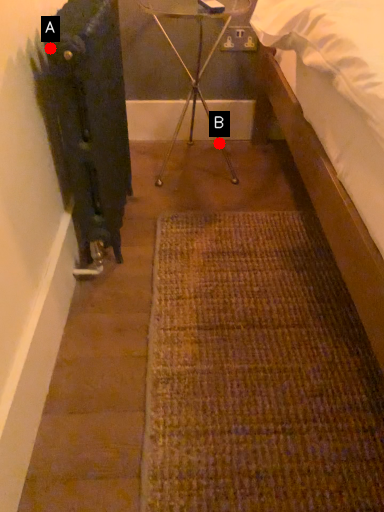
Question: Two points are circled on the image, labeled by A and B beside each circle. Which of the following is the closest to the observer?

Choices:
 (A) A is closer
 (B) B is closer

Answer: (A)